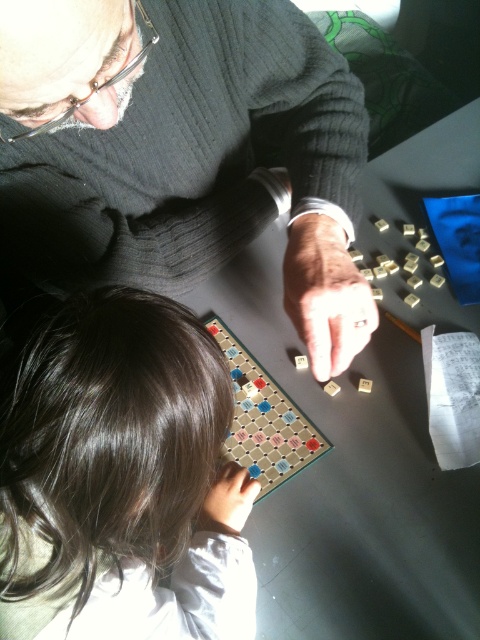
You are a photographer standing 12 inches away from the matte black scrabble tiles at center. Can you take a clear photo of them without moving your position?

The matte black scrabble tiles at center are 11.84 inches away from the camera, so you can take a clear photo of them without moving your position since you are within the required distance.

You are designing a storage box for the game pieces. The storage box must accommodate both the matte black scrabble tiles at center and the wooden scrabble board at center. Considering their sizes, which object requires a taller storage compartment?

The matte black scrabble tiles at center require a taller storage compartment because they have a greater height compared to the wooden scrabble board at center.

Looking at this image, you are a game assistant trying to place a new tile on the board. The board has coordinates from 0 to 1 in both x and y directions. The existing matte black scrabble tiles at center are located at point 0.239, 0.379. If you want to place a new tile at point 0.25, 0.38, will it overlap with the existing tiles?

The new tile at point (x=182, y=160) is very close to the existing matte black scrabble tiles at center at (x=181, y=152). Depending on the size of the tiles, there might be an overlap. However, since the exact dimensions aren not provided, it is recommended to check the distance between the points. The distance between the two points can be calculated using the distance formula sqrt. If the distance is less than the tile size, then they will overlap.